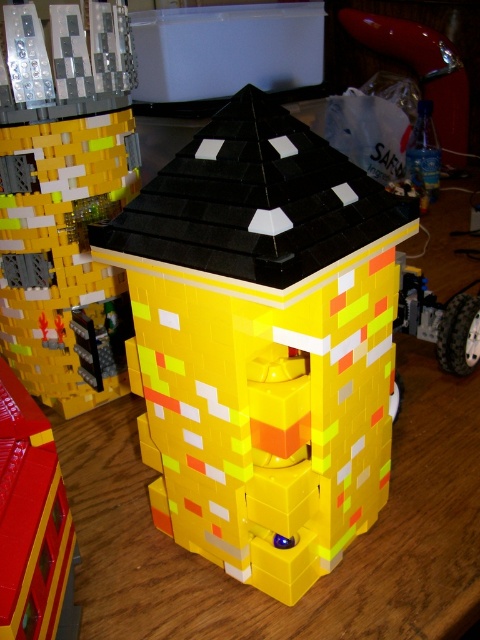
Looking at this image, you are a child who wants to place a new LEGO brick between the yellow plastic toy at center and the yellow matte building at center. The brick is 15 centimeters long. Can you fit it in the space between them?

The yellow plastic toy at center is 31.26 centimeters away from the yellow matte building at center, so yes, the 15 centimeter LEGO brick can fit in the space between them since it is shorter than the distance between the two objects.

You are holding a measuring tape and need to determine if the yellow plastic toy at center is within a 15 inch safety zone from your current position. Can you confirm if it is within the zone?

The yellow plastic toy at center is 16.02 inches away from the viewer, which is just outside the 15 inch safety zone.